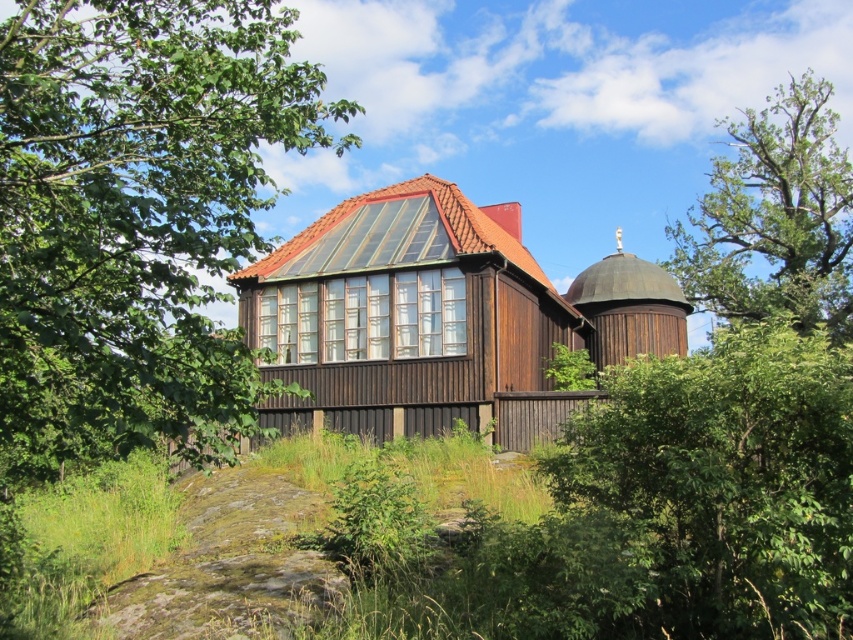
Question: Which point is farther to the camera?

Choices:
 (A) green leafy bush at center
 (B) green leafy tree at upper left

Answer: (A)

Question: Which of the following is the farthest from the observer?

Choices:
 (A) (633, 397)
 (B) (746, 244)
 (C) (13, 272)

Answer: (B)

Question: Does green leafy tree at upper left appear over green leafy tree at upper right?

Choices:
 (A) no
 (B) yes

Answer: (A)

Question: Which object is the closest to the green leafy tree at upper right?

Choices:
 (A) green leafy bush at center
 (B) green leafy tree at upper left

Answer: (B)

Question: Where is green leafy tree at upper left located in relation to green leafy tree at upper right in the image?

Choices:
 (A) below
 (B) above

Answer: (A)

Question: Where is green leafy tree at upper left located in relation to green leafy bush at center in the image?

Choices:
 (A) below
 (B) above

Answer: (B)